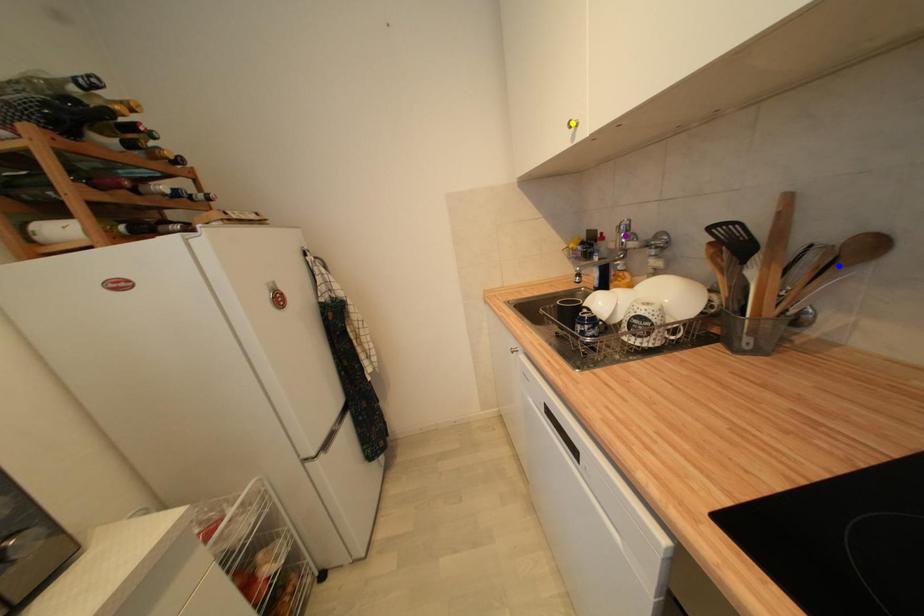
Consider the image. Order these from nearest to farthest:
- purple point
- yellow point
- blue point

purple point → yellow point → blue point